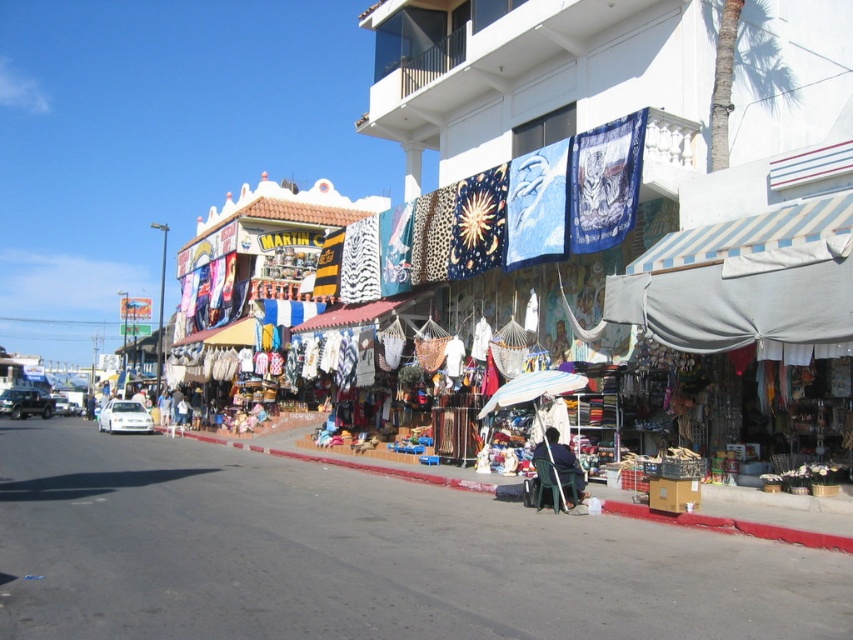
Looking at this image, does white fabric umbrella at center have a lesser height compared to dark blue fabric at center?

Yes.

At what (x,y) coordinates should I click in order to perform the action: click on white fabric umbrella at center. Please return your answer as a coordinate pair (x, y). Looking at the image, I should click on (532, 388).